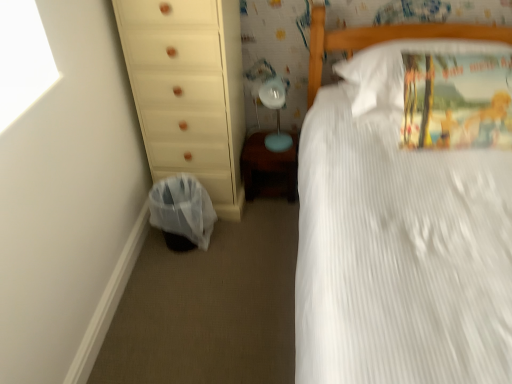
Question: Is wooden changing table at lower center taller or shorter than white cotton pillow at upper right?

Choices:
 (A) tall
 (B) short

Answer: (A)

Question: Is point (260, 152) closer or farther from the camera than point (396, 49)?

Choices:
 (A) farther
 (B) closer

Answer: (A)

Question: Which of these objects is positioned closest to the white cotton pillow at upper right?

Choices:
 (A) wooden changing table at lower center
 (B) plastic bag at lower left
 (C) matte blue table lamp at center
 (D) white wood chest of drawers at left
 (E) white textured bed at right

Answer: (E)

Question: Based on their relative distances, which object is farther from the matte blue table lamp at center?

Choices:
 (A) wooden changing table at lower center
 (B) white textured bed at right
 (C) white wood chest of drawers at left
 (D) plastic bag at lower left
 (E) white cotton pillow at upper right

Answer: (B)